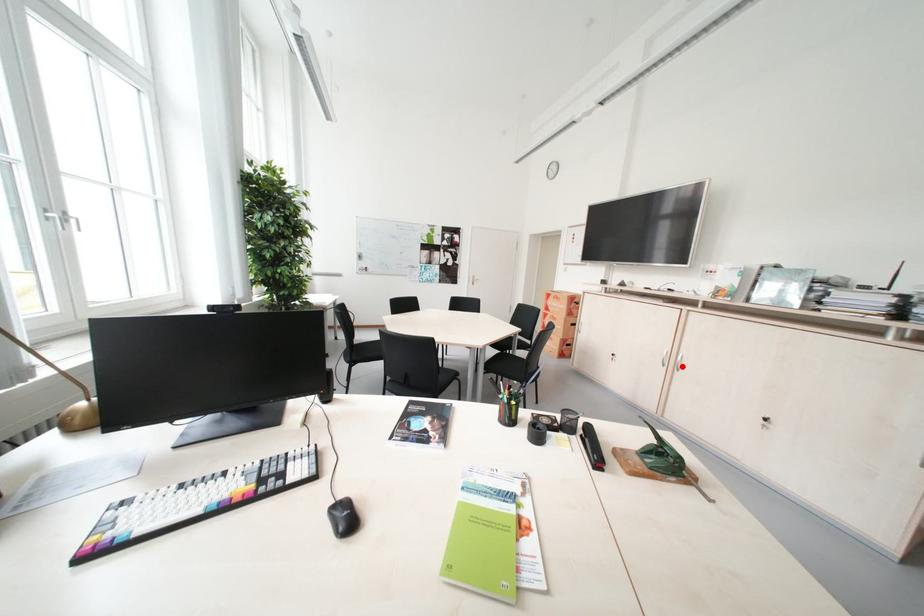
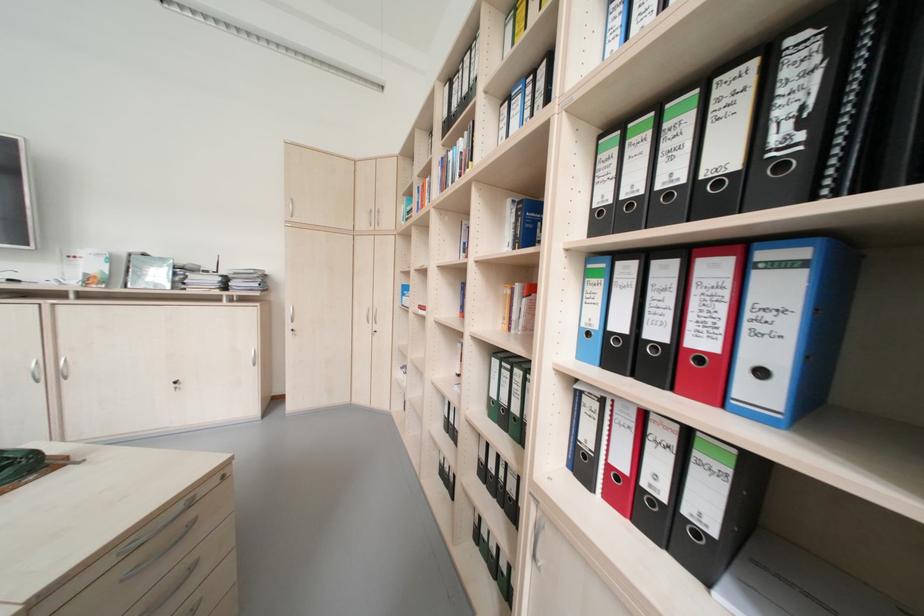
Question: I am providing you with two images of the same scene from different viewpoints. In image1, a red point is highlighted. Considering the same 3D point in image2, which of the following is correct?

Choices:
 (A) It is closer
 (B) It is farther

Answer: (A)